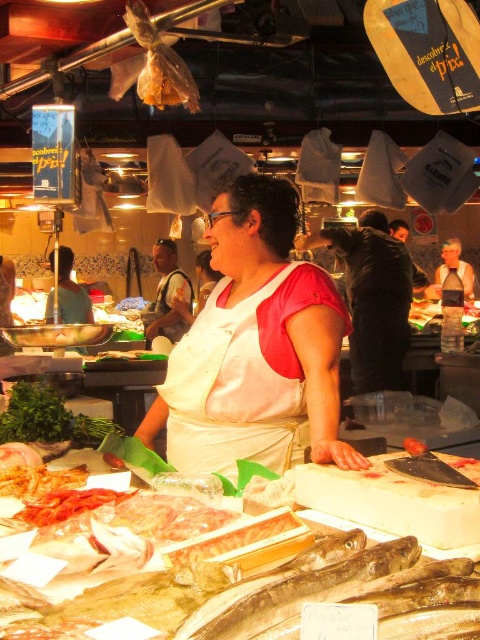
You are a customer at the fish market and want to ask the woman behind the counter a question. Which object, the white matte apron at center or the matte white apron at center, is closer to you?

The white matte apron at center is closer to the viewer than the matte white apron at center.

You are a customer standing at the entrance of the fish market and see both the white fabric apron at center and the matte white apron at center. If you want to approach the counter where the woman is standing, which apron should you head towards first?

The white fabric apron at center is closer to you than the matte white apron at center since the distance between them is 5.45 meters, so you should head towards the white fabric apron at center first.